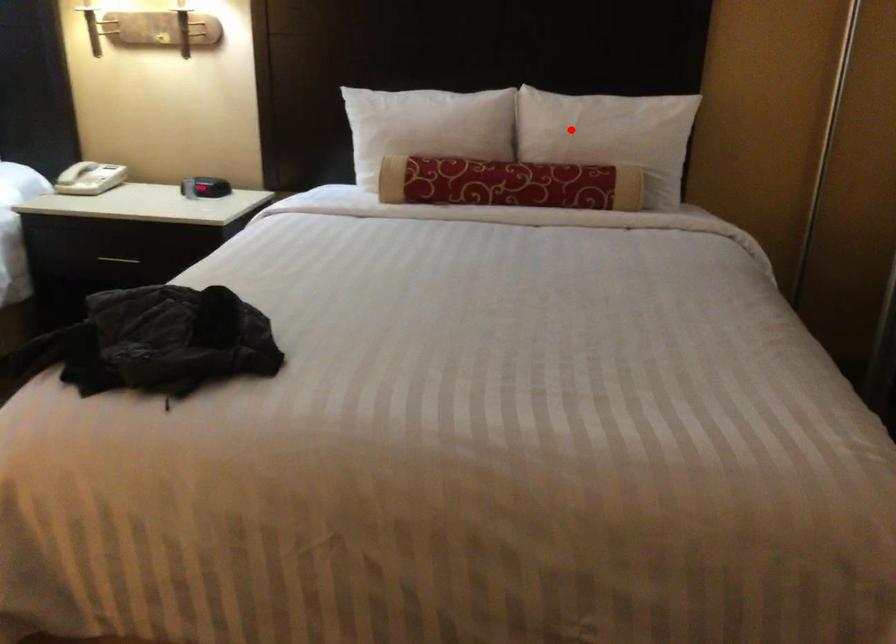
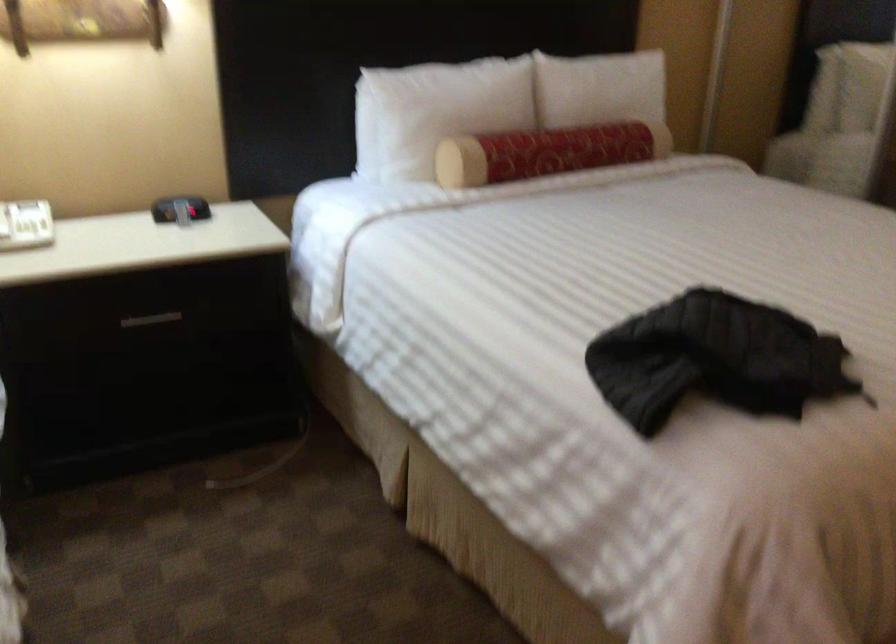
In the second image, find the point that corresponds to the highlighted location in the first image.

(599, 88)